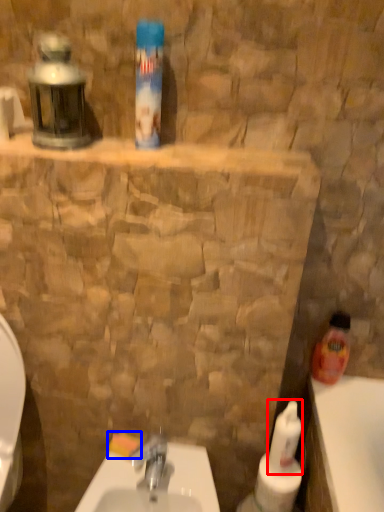
Question: Which of the following is the closest to the observer, cleaning product (highlighted by a red box) or soap (highlighted by a blue box)?

Choices:
 (A) cleaning product
 (B) soap

Answer: (A)